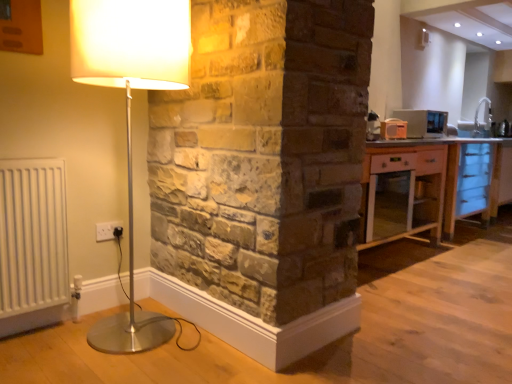
Question: Should I look upward or downward to see white ceramic sink at upper right?

Choices:
 (A) down
 (B) up

Answer: (B)

Question: Is light wood cabinet at right looking in the opposite direction of metallic silver microwave at upper right?

Choices:
 (A) yes
 (B) no

Answer: (B)

Question: Is light wood cabinet at right at the left side of metallic silver microwave at upper right?

Choices:
 (A) yes
 (B) no

Answer: (B)

Question: From a real-world perspective, is light wood cabinet at right located higher than metallic silver microwave at upper right?

Choices:
 (A) no
 (B) yes

Answer: (A)

Question: Considering the relative sizes of light wood cabinet at right and metallic silver microwave at upper right in the image provided, is light wood cabinet at right shorter than metallic silver microwave at upper right?

Choices:
 (A) yes
 (B) no

Answer: (B)

Question: Is light wood cabinet at right located outside metallic silver microwave at upper right?

Choices:
 (A) yes
 (B) no

Answer: (A)

Question: Is light wood cabinet at right facing towards metallic silver microwave at upper right?

Choices:
 (A) no
 (B) yes

Answer: (A)

Question: Does white ceramic sink at upper right have a greater height compared to light wood cabinet at right?

Choices:
 (A) no
 (B) yes

Answer: (A)

Question: Is white ceramic sink at upper right not close to light wood cabinet at right?

Choices:
 (A) no
 (B) yes

Answer: (B)

Question: Is white ceramic sink at upper right bigger than light wood cabinet at right?

Choices:
 (A) no
 (B) yes

Answer: (A)

Question: Is white ceramic sink at upper right in contact with light wood cabinet at right?

Choices:
 (A) no
 (B) yes

Answer: (A)

Question: Is white ceramic sink at upper right facing towards light wood cabinet at right?

Choices:
 (A) no
 (B) yes

Answer: (A)

Question: Considering the relative sizes of white ceramic sink at upper right and light wood cabinet at right in the image provided, is white ceramic sink at upper right thinner than light wood cabinet at right?

Choices:
 (A) yes
 (B) no

Answer: (A)

Question: From the image's perspective, is matte white lamp at left located beneath metallic silver microwave at upper right?

Choices:
 (A) yes
 (B) no

Answer: (A)